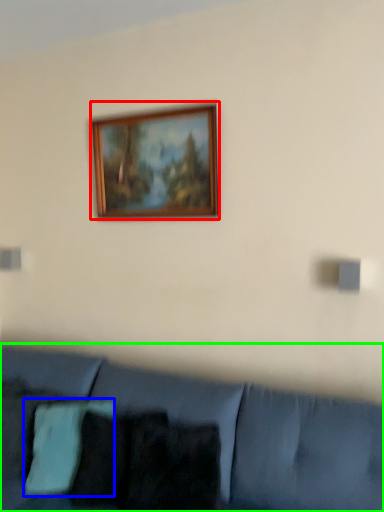
Question: Which object is the closest to the picture frame (highlighted by a red box)? Choose among these: pillow (highlighted by a blue box) or studio couch (highlighted by a green box).

Choices:
 (A) pillow
 (B) studio couch

Answer: (B)